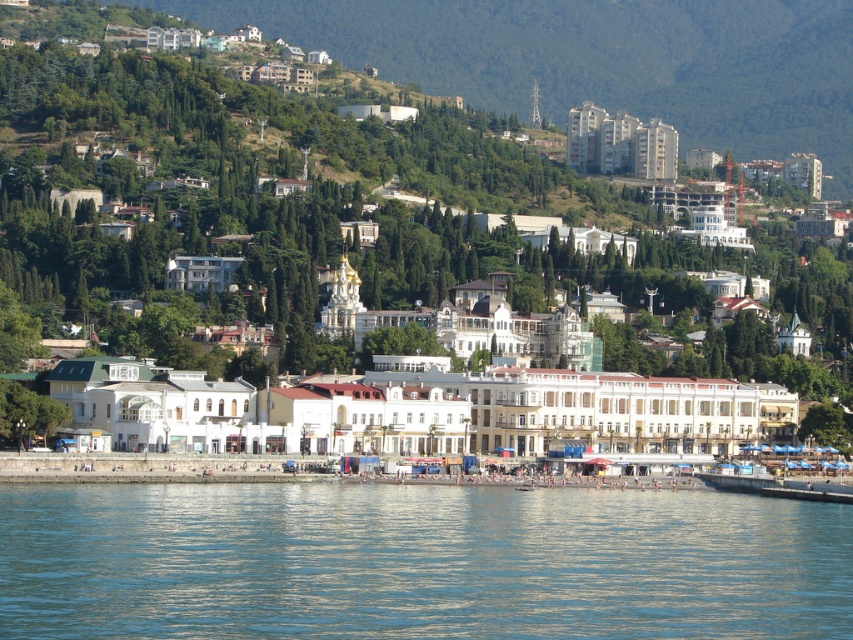
Between white glossy building at center and clear blue water at lower center, which one is positioned lower?

clear blue water at lower center is below.

Can you confirm if white glossy building at center is bigger than clear blue water at lower center?

Correct, white glossy building at center is larger in size than clear blue water at lower center.

Does point (718, 232) come closer to viewer compared to point (364, 536)?

No, it is not.

This screenshot has width=853, height=640. What are the coordinates of `white glossy building at center` in the screenshot? It's located at (386, 218).